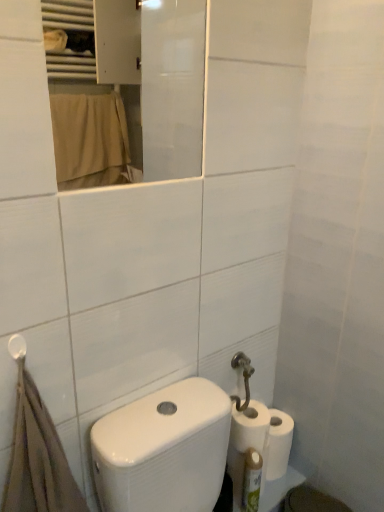
The height and width of the screenshot is (512, 384). Identify the location of brown cotton bath towel at lower left. (38, 458).

What do you see at coordinates (17, 347) in the screenshot? The height and width of the screenshot is (512, 384). I see `white plastic towel bar at upper left` at bounding box center [17, 347].

What is the approximate width of white glossy bidet at lower right?

The width of white glossy bidet at lower right is 6.28 inches.

Image resolution: width=384 pixels, height=512 pixels. What do you see at coordinates (247, 444) in the screenshot? I see `white matte toilet paper at lower right, placed as the 1th toilet paper when sorted from bottom to top` at bounding box center [247, 444].

Image resolution: width=384 pixels, height=512 pixels. What do you see at coordinates (263, 436) in the screenshot?
I see `white matte toilet paper at lower right, which is counted as the second toilet paper, starting from the top` at bounding box center [263, 436].

What do you see at coordinates (251, 481) in the screenshot?
I see `green plastic bottle at lower right` at bounding box center [251, 481].

I want to click on brown cotton bath towel at lower left, so click(x=38, y=458).

Who is bigger, white matte toilet paper at lower right, which is counted as the second toilet paper, starting from the top, or white plastic towel bar at upper left?

With larger size is white matte toilet paper at lower right, which is counted as the second toilet paper, starting from the top.

Can we say white matte toilet paper at lower right, the 2th toilet paper positioned from the bottom, lies outside white plastic towel bar at upper left?

Yes.

Find the location of a particular element. Image resolution: width=384 pixels, height=512 pixels. towel bar that appears on the left of white matte toilet paper at lower right, which is counted as the second toilet paper, starting from the top is located at coordinates tap(17, 347).

From the image's perspective, between brown cotton bath towel at lower left and white matte toilet paper at lower right, placed as the 1th toilet paper when sorted from bottom to top, which one is located above?

brown cotton bath towel at lower left.

Is brown cotton bath towel at lower left turned away from white matte toilet paper at lower right, placed as the 1th toilet paper when sorted from bottom to top?

No, brown cotton bath towel at lower left's orientation is not away from white matte toilet paper at lower right, placed as the 1th toilet paper when sorted from bottom to top.

Between brown cotton bath towel at lower left and white matte toilet paper at lower right, placed as the 1th toilet paper when sorted from bottom to top, which one has less height?

With less height is white matte toilet paper at lower right, placed as the 1th toilet paper when sorted from bottom to top.

From a real-world perspective, is brown cotton bath towel at lower left physically located above or below white matte toilet paper at lower right, placed as the third toilet paper when sorted from top to bottom?

In terms of real-world spatial position, brown cotton bath towel at lower left is above white matte toilet paper at lower right, placed as the third toilet paper when sorted from top to bottom.

In the scene shown: From a real-world perspective, is white plastic towel bar at upper left physically above white matte toilet paper at lower right, which is counted as the second toilet paper, starting from the top?

Correct, in the physical world, white plastic towel bar at upper left is higher than white matte toilet paper at lower right, which is counted as the second toilet paper, starting from the top.

Is white plastic towel bar at upper left taller than white matte toilet paper at lower right, the 2th toilet paper positioned from the bottom?

No, white plastic towel bar at upper left is not taller than white matte toilet paper at lower right, the 2th toilet paper positioned from the bottom.

Which is closer to the camera, (12, 355) or (287, 462)?

The point (12, 355) is in front.

From a real-world perspective, between white matte toilet paper at lower right, placed as the third toilet paper when sorted from top to bottom, and white glossy mirror at upper center, who is vertically lower?

white matte toilet paper at lower right, placed as the third toilet paper when sorted from top to bottom, from a real-world perspective.

Considering the sizes of white matte toilet paper at lower right, placed as the third toilet paper when sorted from top to bottom, and white glossy mirror at upper center in the image, is white matte toilet paper at lower right, placed as the third toilet paper when sorted from top to bottom, taller or shorter than white glossy mirror at upper center?

white matte toilet paper at lower right, placed as the third toilet paper when sorted from top to bottom, is shorter than white glossy mirror at upper center.

Is white matte toilet paper at lower right, placed as the third toilet paper when sorted from top to bottom, far from white glossy mirror at upper center?

Yes, white matte toilet paper at lower right, placed as the third toilet paper when sorted from top to bottom, and white glossy mirror at upper center are quite far apart.

The height and width of the screenshot is (512, 384). There is a white glossy mirror at upper center. Identify the location of the 3rd toilet paper below it (from a real-world perspective). (247, 444).

Does white glossy mirror at upper center have a lesser height compared to white matte toilet paper at lower right, which is counted as the first toilet paper, starting from the top?

No, white glossy mirror at upper center is not shorter than white matte toilet paper at lower right, which is counted as the first toilet paper, starting from the top.

Is white glossy mirror at upper center inside the boundaries of white matte toilet paper at lower right, the third toilet paper when ordered from bottom to top, or outside?

white glossy mirror at upper center is located beyond the bounds of white matte toilet paper at lower right, the third toilet paper when ordered from bottom to top.

From the image's perspective, does white glossy mirror at upper center appear lower than white matte toilet paper at lower right, which is counted as the first toilet paper, starting from the top?

Incorrect, from the image's perspective, white glossy mirror at upper center is higher than white matte toilet paper at lower right, which is counted as the first toilet paper, starting from the top.

From a real-world perspective, is white glossy mirror at upper center physically located above or below white matte toilet paper at lower right, which is counted as the first toilet paper, starting from the top?

white glossy mirror at upper center is situated higher than white matte toilet paper at lower right, which is counted as the first toilet paper, starting from the top, in the real world.

From a real-world perspective, is white glossy bidet at lower right above or below green plastic bottle at lower right?

Clearly, from a real-world perspective, white glossy bidet at lower right is below green plastic bottle at lower right.

Where is `toiletry located on the left of white glossy bidet at lower right`? Image resolution: width=384 pixels, height=512 pixels. toiletry located on the left of white glossy bidet at lower right is located at coordinates (251, 481).

Is white glossy bidet at lower right completely or partially outside of green plastic bottle at lower right?

Yes, white glossy bidet at lower right is outside of green plastic bottle at lower right.

Is white glossy bidet at lower right taller or shorter than green plastic bottle at lower right?

Clearly, white glossy bidet at lower right is shorter compared to green plastic bottle at lower right.

Is brown cotton bath towel at lower left spatially inside white glossy mirror at upper center, or outside of it?

brown cotton bath towel at lower left exists outside the volume of white glossy mirror at upper center.

Which object is positioned more to the left, brown cotton bath towel at lower left or white glossy mirror at upper center?

brown cotton bath towel at lower left is more to the left.

Based on the photo, does brown cotton bath towel at lower left come in front of white glossy mirror at upper center?

Yes, it is in front of white glossy mirror at upper center.

Is brown cotton bath towel at lower left facing towards white glossy mirror at upper center?

No, brown cotton bath towel at lower left is not facing towards white glossy mirror at upper center.

Find the location of `towel bar on the left of white matte toilet paper at lower right, which is counted as the second toilet paper, starting from the top`. towel bar on the left of white matte toilet paper at lower right, which is counted as the second toilet paper, starting from the top is located at coordinates (17, 347).

Locate an element on the screen. the 2nd toilet paper behind when counting from the brown cotton bath towel at lower left is located at coordinates (247, 444).

Based on their spatial positions, is white glossy mirror at upper center or brown cotton bath towel at lower left closer to white glossy bidet at lower right?

brown cotton bath towel at lower left is positioned closer to the anchor white glossy bidet at lower right.

From the image, which object appears to be nearer to white matte toilet paper at lower right, which is counted as the second toilet paper, starting from the top, white glossy mirror at upper center or white glossy bidet at lower right?

white glossy bidet at lower right lies closer to white matte toilet paper at lower right, which is counted as the second toilet paper, starting from the top, than the other object.

Considering their positions, is white matte toilet paper at lower right, placed as the 1th toilet paper when sorted from bottom to top, positioned further to white matte toilet paper at lower right, which is counted as the second toilet paper, starting from the top, than green plastic bottle at lower right?

Based on the image, green plastic bottle at lower right appears to be further to white matte toilet paper at lower right, which is counted as the second toilet paper, starting from the top.

Looking at the image, which one is located further to white glossy mirror at upper center, white matte toilet paper at lower right, the 2th toilet paper positioned from the bottom, or brown cotton bath towel at lower left?

brown cotton bath towel at lower left lies further to white glossy mirror at upper center than the other object.

Looking at the image, which one is located closer to white matte toilet paper at lower right, placed as the third toilet paper when sorted from top to bottom, white plastic towel bar at upper left or brown cotton bath towel at lower left?

brown cotton bath towel at lower left.

Looking at the image, which one is located further to white matte toilet paper at lower right, which is counted as the first toilet paper, starting from the top, white glossy mirror at upper center or white matte toilet paper at lower right, which is counted as the second toilet paper, starting from the top?

white glossy mirror at upper center.

Considering their positions, is white glossy bidet at lower right positioned further to white glossy mirror at upper center than white plastic towel bar at upper left?

Based on the image, white glossy bidet at lower right appears to be further to white glossy mirror at upper center.

Which object lies nearer to the anchor point brown cotton bath towel at lower left, white plastic towel bar at upper left or white glossy bidet at lower right?

white plastic towel bar at upper left is closer to brown cotton bath towel at lower left.

I want to click on bath towel between white glossy mirror at upper center and green plastic bottle at lower right in the up-down direction, so click(38, 458).

Find the location of a particular element. The height and width of the screenshot is (512, 384). towel bar between white glossy mirror at upper center and white glossy bidet at lower right in the vertical direction is located at coordinates (17, 347).

Locate an element on the screen. toiletry situated between white plastic towel bar at upper left and white matte toilet paper at lower right, which is counted as the second toilet paper, starting from the top, from left to right is located at coordinates (251, 481).

This screenshot has height=512, width=384. In order to click on towel bar positioned between brown cotton bath towel at lower left and white matte toilet paper at lower right, which is counted as the first toilet paper, starting from the top, from near to far in this screenshot , I will do `click(17, 347)`.